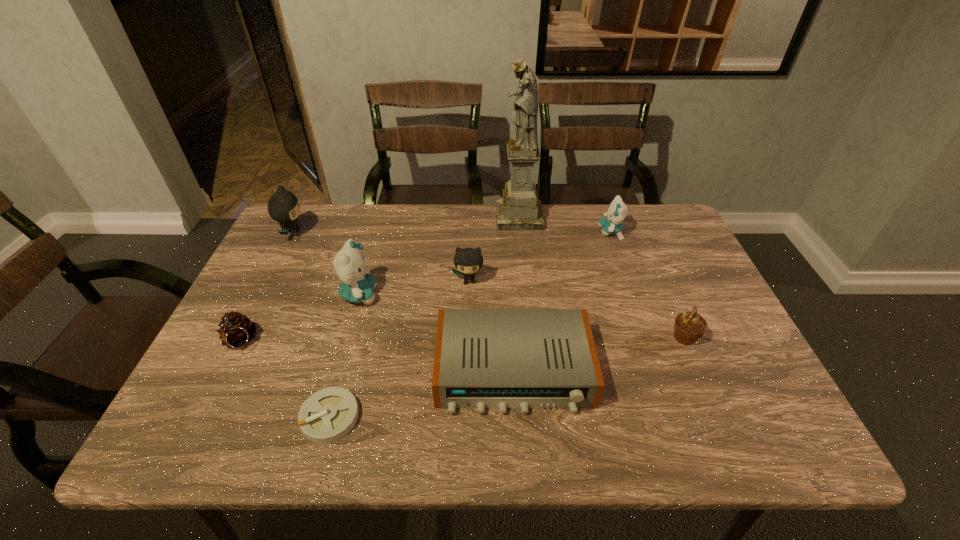
In the image, there is a desktop. What are the coordinates of `free space at the far right corner` in the screenshot? It's located at (660, 229).

The image size is (960, 540). In order to click on free space between the brown pinecone and the third kitten from left to right in this screenshot , I will do `click(354, 312)`.

Image resolution: width=960 pixels, height=540 pixels. I want to click on free space between the rightmost object and the radio receiver, so click(x=599, y=354).

Locate an element on the screen. This screenshot has height=540, width=960. empty location between the left gray kitten and the pinecone is located at coordinates (266, 288).

This screenshot has width=960, height=540. In order to click on free point between the gray sculpture and the second kitten from left to right in this screenshot , I will do `click(440, 255)`.

This screenshot has width=960, height=540. Identify the location of free spot between the radio receiver and the sculpture. (516, 294).

At what (x,y) coordinates should I click in order to perform the action: click on free space between the shortest object and the pinecone. Please return your answer as a coordinate pair (x, y). This screenshot has height=540, width=960. Looking at the image, I should click on (285, 380).

Locate an element on the screen. free space that is in between the left blue kitten and the tallest object is located at coordinates (440, 255).

Find the location of a particular element. free spot between the rightmost object and the rightmost kitten is located at coordinates (647, 285).

Locate an element on the screen. the third closest object to the sculpture is located at coordinates 357,285.